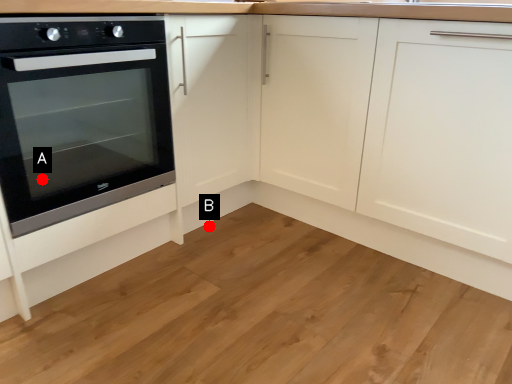
Question: Two points are circled on the image, labeled by A and B beside each circle. Which point is closer to the camera taking this photo?

Choices:
 (A) A is closer
 (B) B is closer

Answer: (A)